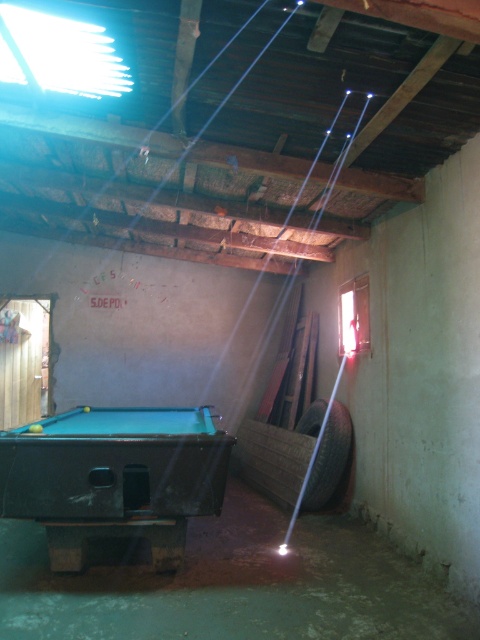
Can you confirm if green felt pool table at center is positioned to the right of black rubber tire at lower right?

Incorrect, green felt pool table at center is not on the right side of black rubber tire at lower right.

Is green felt pool table at center thinner than black rubber tire at lower right?

In fact, green felt pool table at center might be wider than black rubber tire at lower right.

Is point (111, 432) positioned after point (340, 456)?

That is False.

Where is `green felt pool table at center`? This screenshot has width=480, height=640. green felt pool table at center is located at coordinates (115, 477).